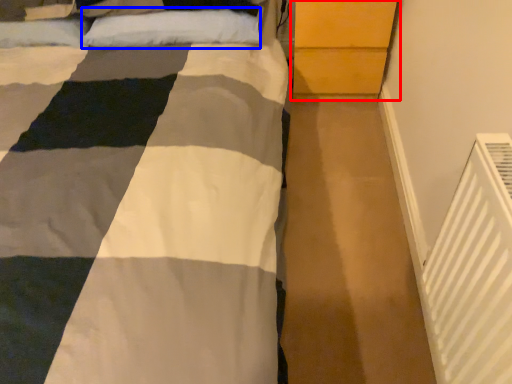
Question: Among these objects, which one is farthest to the camera, dresser (highlighted by a red box) or pillow (highlighted by a blue box)?

Choices:
 (A) dresser
 (B) pillow

Answer: (A)